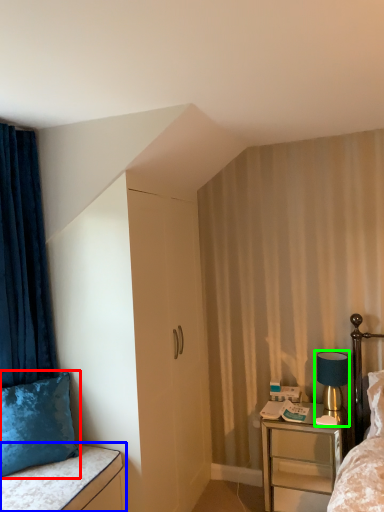
Question: Considering the real-world distances, which object is closest to pillow (highlighted by a red box)? vanity (highlighted by a blue box) or bedside lamp (highlighted by a green box).

Choices:
 (A) vanity
 (B) bedside lamp

Answer: (A)